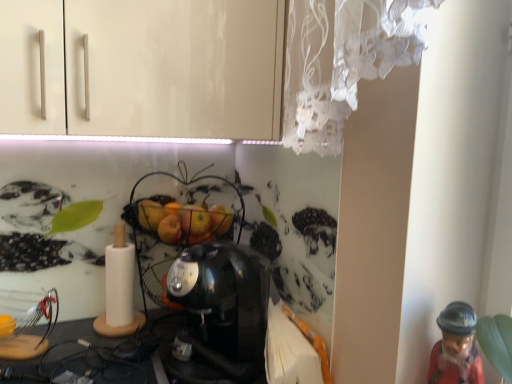
Question: Is metallic wire basket at center turned away from red glossy figurine at lower right?

Choices:
 (A) yes
 (B) no

Answer: (B)

Question: Considering the relative positions of metallic wire basket at center and red glossy figurine at lower right in the image provided, is metallic wire basket at center to the right of red glossy figurine at lower right from the viewer's perspective?

Choices:
 (A) yes
 (B) no

Answer: (B)

Question: From the image's perspective, does metallic wire basket at center appear higher than red glossy figurine at lower right?

Choices:
 (A) yes
 (B) no

Answer: (A)

Question: Is metallic wire basket at center to the left of red glossy figurine at lower right from the viewer's perspective?

Choices:
 (A) no
 (B) yes

Answer: (B)

Question: Considering the relative sizes of metallic wire basket at center and red glossy figurine at lower right in the image provided, is metallic wire basket at center smaller than red glossy figurine at lower right?

Choices:
 (A) yes
 (B) no

Answer: (B)

Question: Considering the positions of satin black coffee maker at center and red glossy figurine at lower right in the image, is satin black coffee maker at center taller or shorter than red glossy figurine at lower right?

Choices:
 (A) short
 (B) tall

Answer: (B)

Question: Is satin black coffee maker at center inside the boundaries of red glossy figurine at lower right, or outside?

Choices:
 (A) inside
 (B) outside

Answer: (B)

Question: From a real-world perspective, relative to red glossy figurine at lower right, is satin black coffee maker at center vertically above or below?

Choices:
 (A) above
 (B) below

Answer: (B)

Question: Is point (206, 261) closer or farther from the camera than point (458, 302)?

Choices:
 (A) farther
 (B) closer

Answer: (A)

Question: In terms of size, does red glossy figurine at lower right appear bigger or smaller than metallic wire basket at center?

Choices:
 (A) big
 (B) small

Answer: (B)

Question: Looking at their shapes, would you say red glossy figurine at lower right is wider or thinner than metallic wire basket at center?

Choices:
 (A) thin
 (B) wide

Answer: (A)

Question: From the image's perspective, is red glossy figurine at lower right positioned above or below metallic wire basket at center?

Choices:
 (A) above
 (B) below

Answer: (B)

Question: From a real-world perspective, is red glossy figurine at lower right positioned above or below metallic wire basket at center?

Choices:
 (A) above
 (B) below

Answer: (B)

Question: Is satin black coffee maker at center in front of or behind metallic wire basket at center in the image?

Choices:
 (A) behind
 (B) front

Answer: (B)

Question: Is point (236, 306) positioned closer to the camera than point (151, 291)?

Choices:
 (A) farther
 (B) closer

Answer: (B)